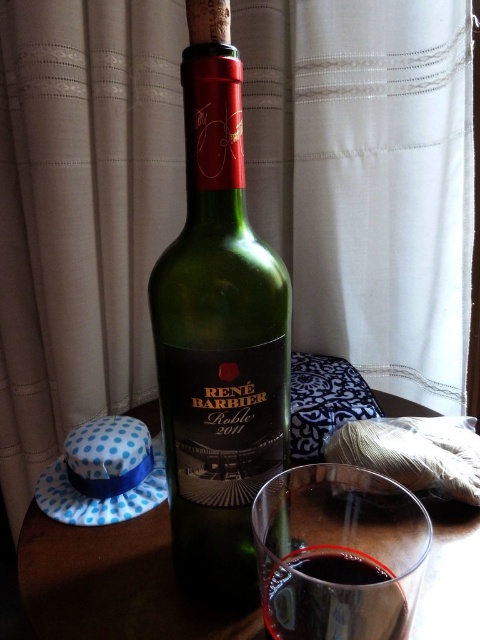
You have a container that can hold up to 500 milliliters. You want to pour the dark red liquid at center into it. Based on the size comparison between the green glass bottle at center and the liquid, can you determine if the container will be sufficient?

The green glass bottle at center is larger in size than the dark red liquid at center, which means the liquid might be less than the bottle capacity. Since the container can hold up to 500 milliliters, it should be sufficient unless the liquid exceeds that volume. However, without exact measurements, we can only assume the container is adequate based on the size comparison.